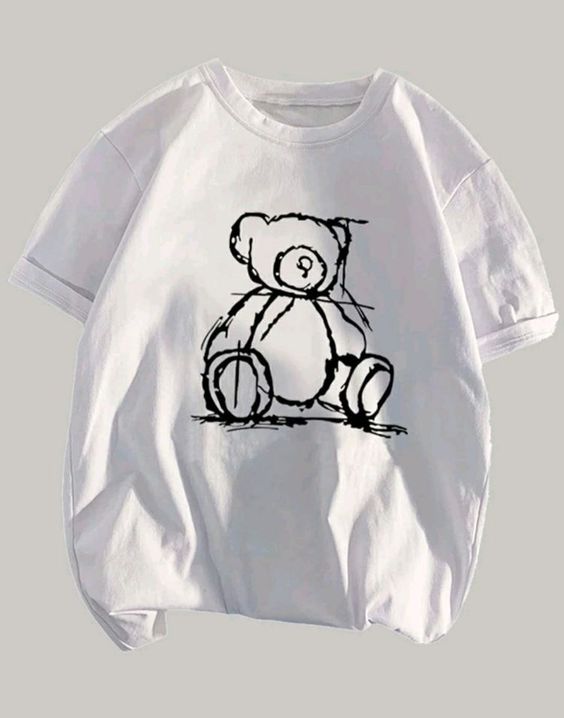
Find the location of a particular element. This screenshot has width=564, height=718. teddy bear is located at coordinates click(289, 235).